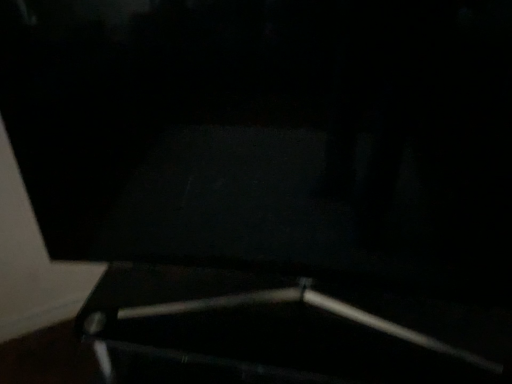
What do you see at coordinates (283, 331) in the screenshot? I see `metallic silver stand at center` at bounding box center [283, 331].

Identify the location of metallic silver stand at center. Image resolution: width=512 pixels, height=384 pixels. (283, 331).

You are a GUI agent. You are given a task and a screenshot of the screen. Output one action in this format:
    pyautogui.click(x=<x>, y=<y>)
    Task: Click on the metallic silver stand at center
    The width and height of the screenshot is (512, 384).
    Given the screenshot: What is the action you would take?
    pyautogui.click(x=283, y=331)